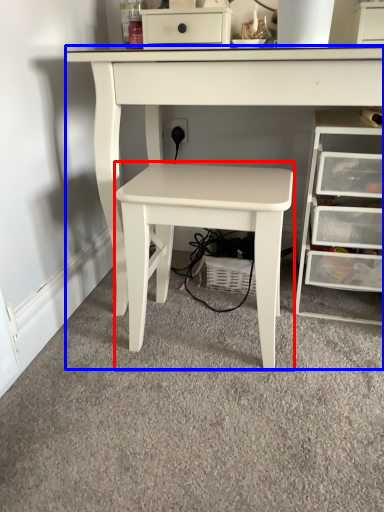
Question: Among these objects, which one is nearest to the camera, table (highlighted by a red box) or table (highlighted by a blue box)?

Choices:
 (A) table
 (B) table

Answer: (B)